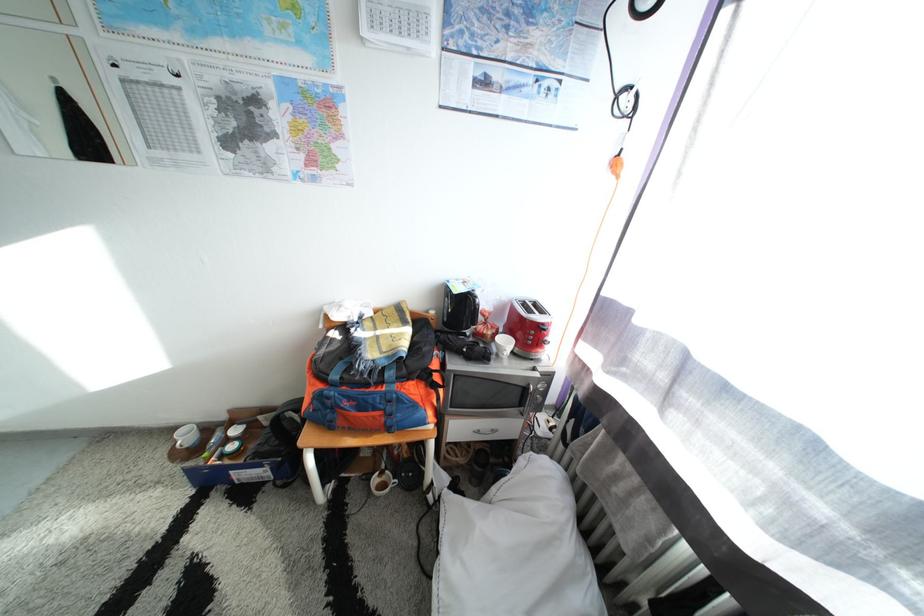
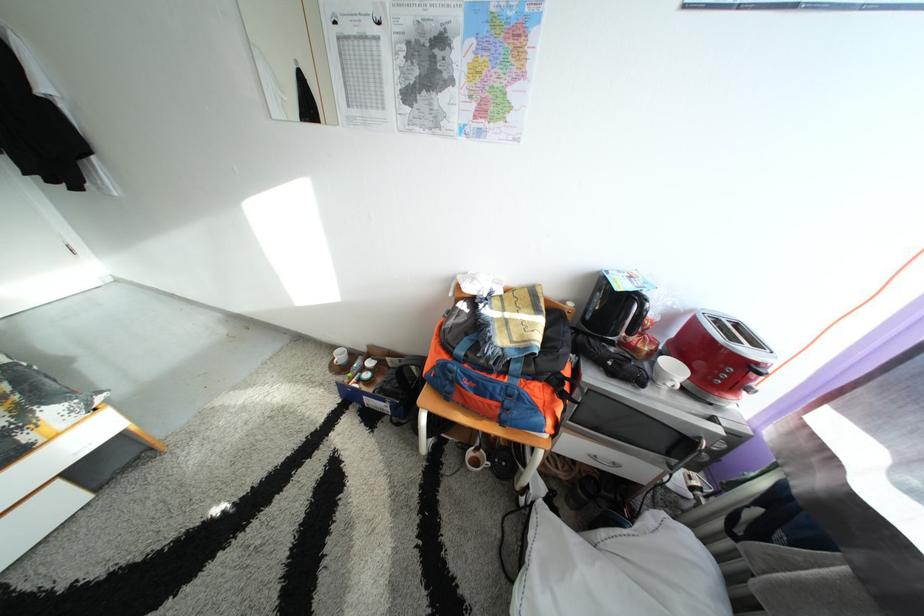
Question: The first image is from the beginning of the video and the second image is from the end. How did the camera likely rotate when shooting the video?

Choices:
 (A) Left
 (B) Right
 (C) Up
 (D) Down

Answer: (A)